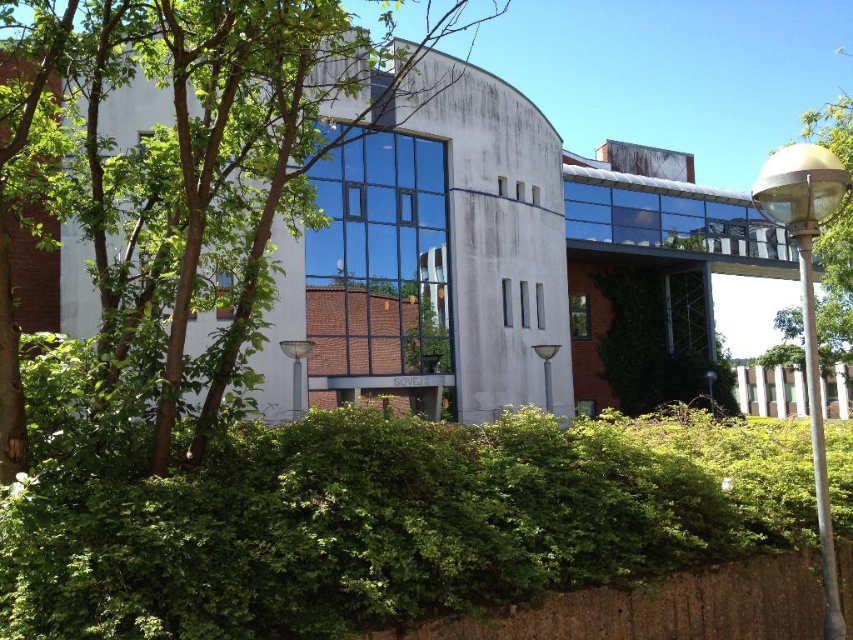
Between green leafy hedge at center and green leafy tree at center, which one has more height?

With more height is green leafy tree at center.

Which is more to the right, green leafy hedge at center or green leafy tree at center?

green leafy hedge at center

Between point (108, 564) and point (26, 243), which one is positioned behind?

The point (26, 243) is more distant.

The width and height of the screenshot is (853, 640). Find the location of `green leafy hedge at center`. green leafy hedge at center is located at coordinates (392, 524).